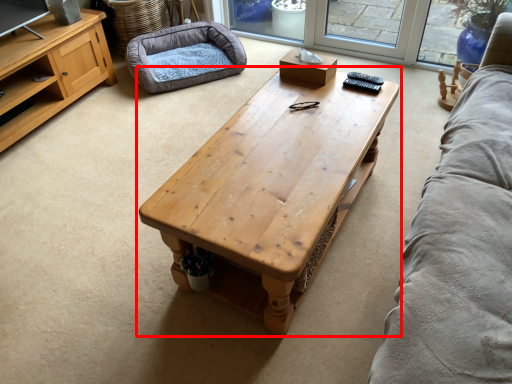
Question: Where is coffee table (annotated by the red box) located in relation to dog bed in the image?

Choices:
 (A) right
 (B) left

Answer: (A)